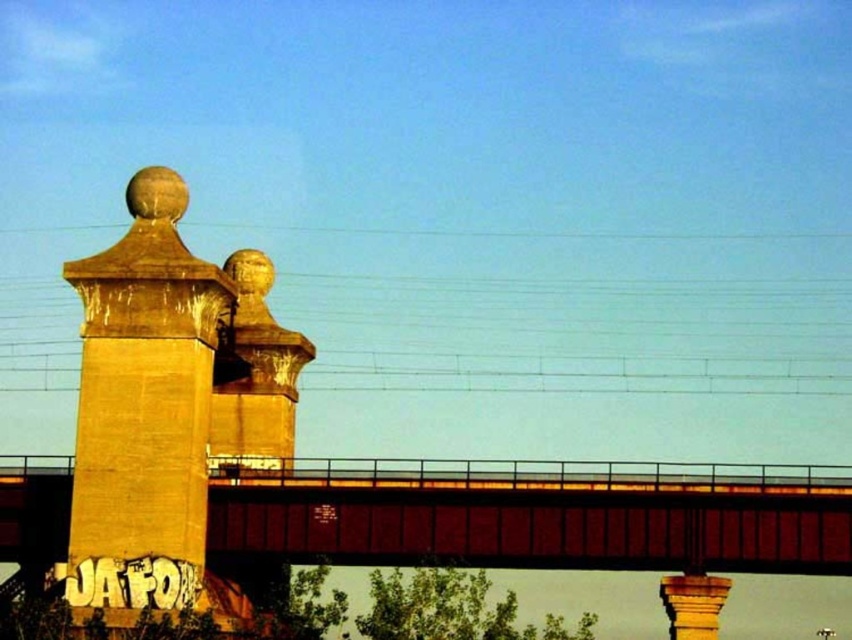
Question: Which point is closer to the camera?

Choices:
 (A) metallic bridge at center
 (B) gold textured ball at upper center

Answer: (A)

Question: Among these points, which one is nearest to the camera?

Choices:
 (A) (671, 513)
 (B) (217, 394)
 (C) (165, 166)

Answer: (A)

Question: Estimate the real-world distances between objects in this image. Which object is farther from the yellowish concrete pillar at left?

Choices:
 (A) gold textured ball at upper center
 (B) metallic bridge at center

Answer: (B)

Question: Does metallic bridge at center have a lesser width compared to yellowish concrete pillar at left?

Choices:
 (A) yes
 (B) no

Answer: (B)

Question: Is yellowish concrete pillar at left closer to camera compared to gold textured ball at upper center?

Choices:
 (A) yes
 (B) no

Answer: (A)

Question: In this image, where is metallic bridge at center located relative to yellowish concrete pillar at left?

Choices:
 (A) right
 (B) left

Answer: (A)